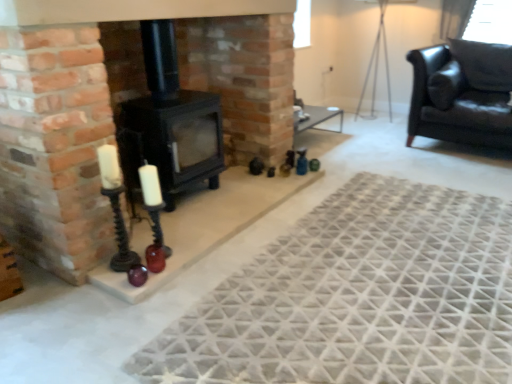
Question: Is textured gray rug at center next to black leather couch at upper right and touching it?

Choices:
 (A) no
 (B) yes

Answer: (A)

Question: From the image's perspective, does textured gray rug at center appear higher than black leather couch at upper right?

Choices:
 (A) no
 (B) yes

Answer: (A)

Question: From a real-world perspective, is textured gray rug at center physically below black leather couch at upper right?

Choices:
 (A) no
 (B) yes

Answer: (B)

Question: Is textured gray rug at center to the left of black leather couch at upper right from the viewer's perspective?

Choices:
 (A) yes
 (B) no

Answer: (A)

Question: Does textured gray rug at center have a lesser height compared to black leather couch at upper right?

Choices:
 (A) yes
 (B) no

Answer: (A)

Question: Is textured gray rug at center taller than black leather couch at upper right?

Choices:
 (A) no
 (B) yes

Answer: (A)

Question: Considering the relative sizes of black matte wood burning stove at center and textured gray rug at center in the image provided, is black matte wood burning stove at center thinner than textured gray rug at center?

Choices:
 (A) no
 (B) yes

Answer: (B)

Question: Is black matte wood burning stove at center at the left side of textured gray rug at center?

Choices:
 (A) no
 (B) yes

Answer: (B)

Question: Considering the relative sizes of black matte wood burning stove at center and textured gray rug at center in the image provided, is black matte wood burning stove at center taller than textured gray rug at center?

Choices:
 (A) yes
 (B) no

Answer: (A)

Question: From a real-world perspective, is black matte wood burning stove at center physically below textured gray rug at center?

Choices:
 (A) yes
 (B) no

Answer: (B)

Question: Does black matte wood burning stove at center turn towards textured gray rug at center?

Choices:
 (A) yes
 (B) no

Answer: (A)

Question: Does black matte wood burning stove at center touch textured gray rug at center?

Choices:
 (A) yes
 (B) no

Answer: (B)

Question: Is black glass candle holder at lower left, positioned as the 2th candle holder in left-to-right order, facing towards black matte wood burning stove at center?

Choices:
 (A) yes
 (B) no

Answer: (B)